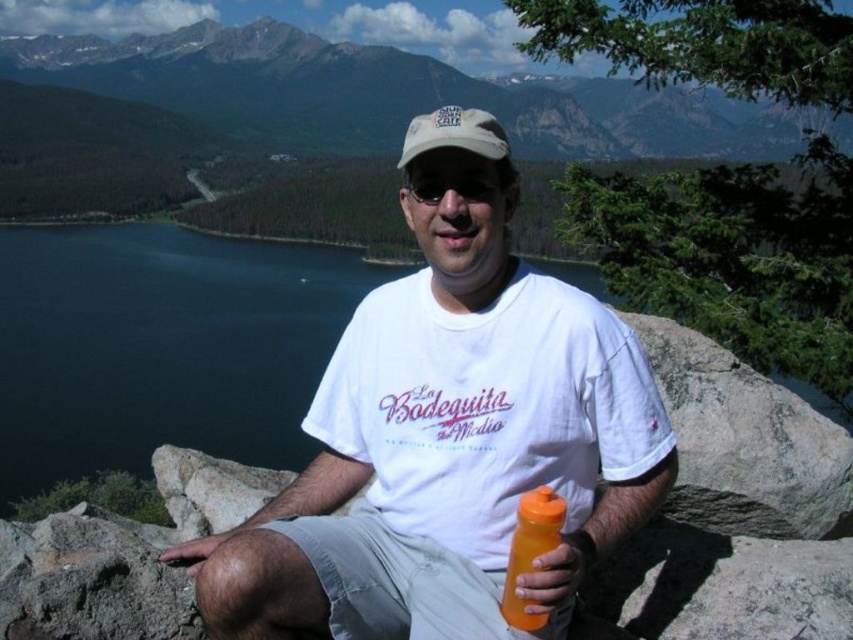
Question: Is rocky mountain range at upper center above white fabric cap at center?

Choices:
 (A) yes
 (B) no

Answer: (A)

Question: Is rocky mountain range at upper center in front of black matte sunglasses at center?

Choices:
 (A) no
 (B) yes

Answer: (A)

Question: Which object appears farthest from the camera in this image?

Choices:
 (A) white fabric cap at center
 (B) orange matte bottle at lower center

Answer: (A)

Question: Which point is farther from the camera taking this photo?

Choices:
 (A) (506, 595)
 (B) (434, 204)
 (C) (404, 136)

Answer: (C)

Question: Is orange matte bottle at lower center positioned behind white fabric cap at center?

Choices:
 (A) yes
 (B) no

Answer: (B)

Question: Among these objects, which one is nearest to the camera?

Choices:
 (A) white fabric cap at center
 (B) white cotton t-shirt at center
 (C) rocky mountain range at upper center
 (D) orange matte bottle at lower center

Answer: (D)